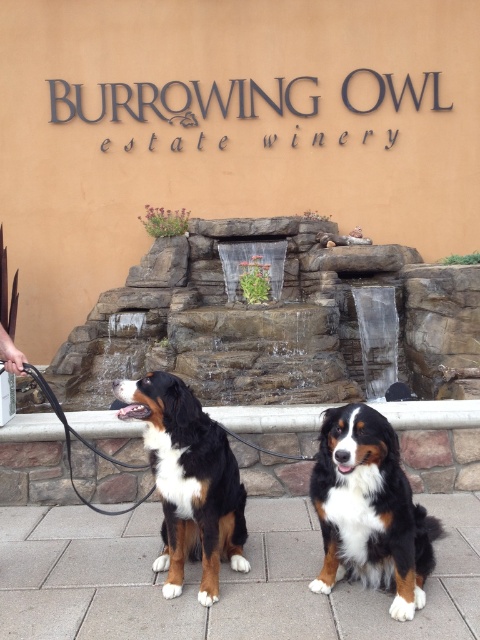
You are a visitor at the Burrowing Owl Estate Winery and see the brown and white fur at center and the black leather leash at left. Which object is nearer to you?

The brown and white fur at center is closer to the viewer than the black leather leash at left.

You are a visitor at the Burrowing Owl Estate Winery and notice two objects near the stone wall with the waterfall. You see the brown and white fur at center and the black rubber leash at left. Which object is narrower?

The brown and white fur at center is narrower than the black rubber leash at left because the brown and white fur at center has a smaller width.